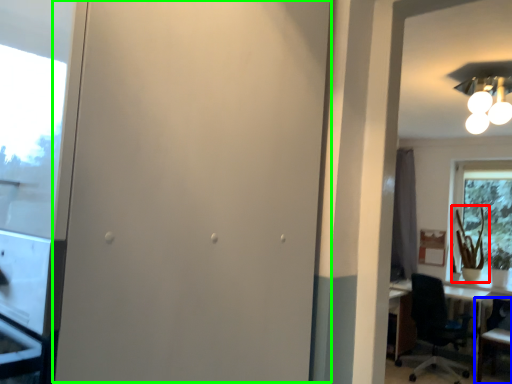
Question: Considering the real-world distances, which object is closest to plant (highlighted by a red box)? chair (highlighted by a blue box) or screen door (highlighted by a green box).

Choices:
 (A) chair
 (B) screen door

Answer: (A)